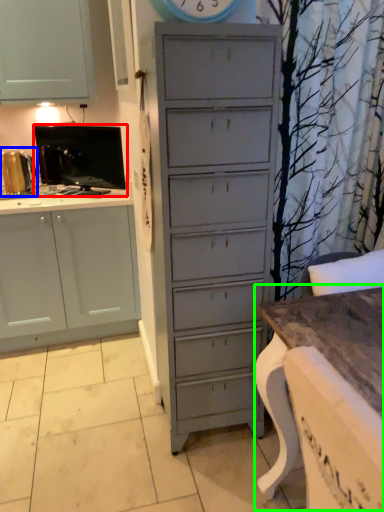
Question: Which is nearer to the appliance (highlighted by a red box)? appliance (highlighted by a blue box) or table (highlighted by a green box).

Choices:
 (A) appliance
 (B) table

Answer: (A)